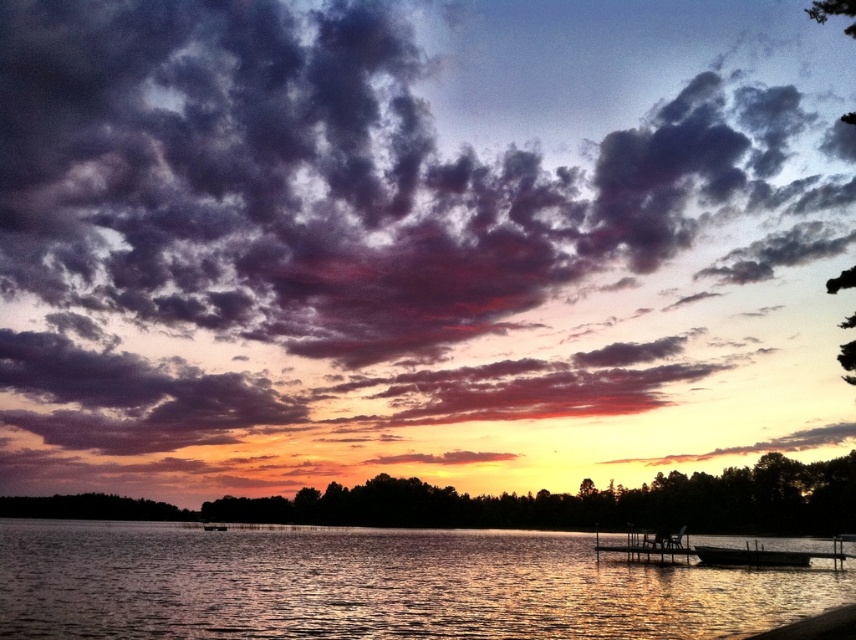
Question: Among these points, which one is farthest from the camera?

Choices:
 (A) tap(366, 532)
 (B) tap(679, 529)
 (C) tap(669, 536)
 (D) tap(718, 556)

Answer: (A)

Question: Which point is closer to the camera?

Choices:
 (A) (229, 602)
 (B) (658, 531)
 (C) (679, 540)
 (D) (758, 561)

Answer: (A)

Question: Is silvery metallic dock at lower right behind wooden park bench at lower right?

Choices:
 (A) no
 (B) yes

Answer: (A)

Question: Does silvery metallic dock at lower right come in front of wooden dock at lower center?

Choices:
 (A) no
 (B) yes

Answer: (B)

Question: Which point is farther from the camera taking this photo?

Choices:
 (A) (744, 545)
 (B) (642, 548)
 (C) (607, 548)

Answer: (A)

Question: From the image, what is the correct spatial relationship of glistening water at center in relation to wooden park bench at lower right?

Choices:
 (A) left
 (B) right

Answer: (A)